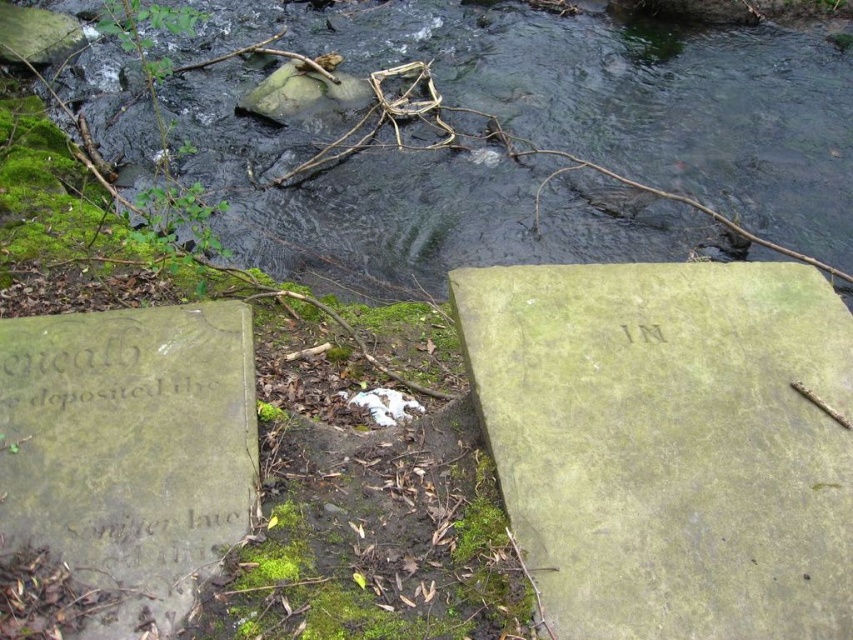
Between point (726, 328) and point (26, 378), which one is positioned in front?

Positioned in front is point (26, 378).

Measure the distance between green stone plaque at center and green mossy stone at lower left.

green stone plaque at center is 35.29 inches away from green mossy stone at lower left.

Find the location of a particular element. The height and width of the screenshot is (640, 853). green stone plaque at center is located at coordinates (669, 444).

Based on the photo, between green mossy rock at upper center and green mossy stone at lower left, which one has less height?

green mossy rock at upper center

Is point (465, 56) in front of point (91, 632)?

No, (465, 56) is further to viewer.

Image resolution: width=853 pixels, height=640 pixels. Find the location of `green mossy rock at upper center`. green mossy rock at upper center is located at coordinates (619, 99).

What do you see at coordinates (619, 99) in the screenshot? The image size is (853, 640). I see `green mossy rock at upper center` at bounding box center [619, 99].

I want to click on green mossy rock at upper center, so click(x=619, y=99).

Does point (457, 192) come behind point (793, 368)?

That is True.

Identify the location of green mossy rock at upper center. Image resolution: width=853 pixels, height=640 pixels. (619, 99).